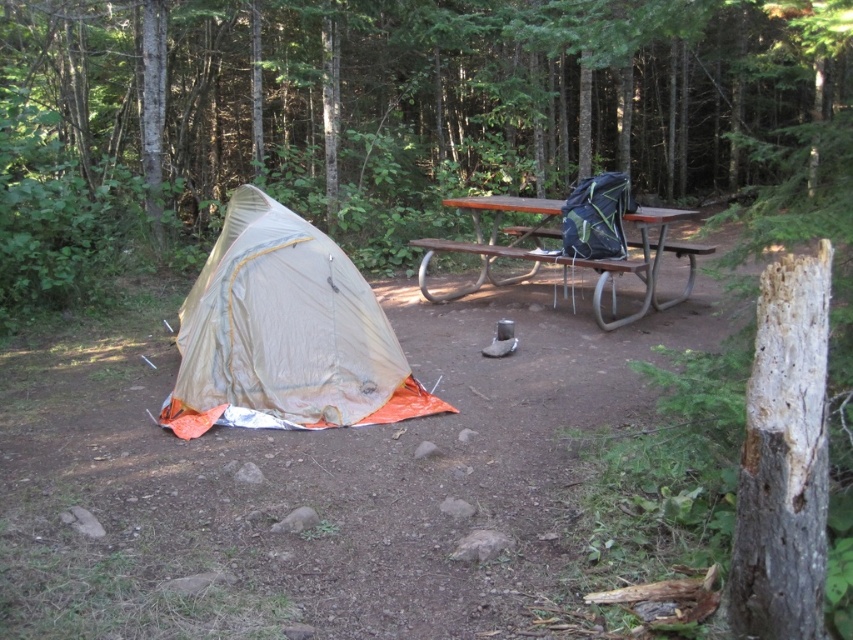
Does point (260, 33) come in front of point (637, 312)?

No, it is not.

Between point (317, 38) and point (640, 241), which one is positioned in front?

Point (640, 241)

The image size is (853, 640). I want to click on smooth bark tree at center, so click(x=438, y=92).

Who is more distant from viewer, (300,364) or (495,202)?

Positioned behind is point (495,202).

What do you see at coordinates (285, 333) in the screenshot? I see `beige/orange fabric tent at left` at bounding box center [285, 333].

You are a GUI agent. You are given a task and a screenshot of the screen. Output one action in this format:
    pyautogui.click(x=<x>, y=<y>)
    Task: Click on the beige/orange fabric tent at left
    Image resolution: width=853 pixels, height=640 pixels.
    Given the screenshot: What is the action you would take?
    pyautogui.click(x=285, y=333)

Is smooth bark tree at center bigger than beige/orange fabric tent at left?

Indeed, smooth bark tree at center has a larger size compared to beige/orange fabric tent at left.

Who is lower down, smooth bark tree at center or beige/orange fabric tent at left?

beige/orange fabric tent at left is lower down.

Between point (254, 131) and point (248, 337), which one is positioned in front?

Point (248, 337) is more forward.

Image resolution: width=853 pixels, height=640 pixels. I want to click on smooth bark tree at center, so (438, 92).